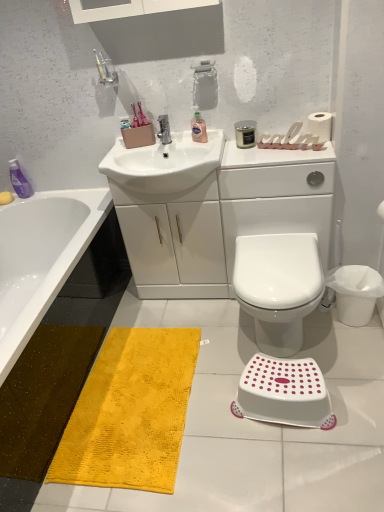
Question: Considering the relative sizes of translucent pink liquid at sink, which is the first toiletry in right-to-left order, and white glossy cabinet at center in the image provided, is translucent pink liquid at sink, which is the first toiletry in right-to-left order, taller than white glossy cabinet at center?

Choices:
 (A) yes
 (B) no

Answer: (B)

Question: Does translucent pink liquid at sink, placed as the 1th toiletry when sorted from top to bottom, contain white glossy cabinet at center?

Choices:
 (A) yes
 (B) no

Answer: (B)

Question: Is translucent pink liquid at sink, placed as the 1th toiletry when sorted from top to bottom, closer to camera compared to white glossy cabinet at center?

Choices:
 (A) no
 (B) yes

Answer: (A)

Question: Can you confirm if translucent pink liquid at sink, positioned as the first toiletry in front-to-back order, is bigger than white glossy cabinet at center?

Choices:
 (A) yes
 (B) no

Answer: (B)

Question: Does translucent pink liquid at sink, the 2th toiletry viewed from the left, have a greater width compared to white glossy cabinet at center?

Choices:
 (A) no
 (B) yes

Answer: (A)

Question: From a real-world perspective, is white matte toilet paper at upper right above or below white glossy toilet at center?

Choices:
 (A) above
 (B) below

Answer: (A)

Question: In terms of width, does white matte toilet paper at upper right look wider or thinner when compared to white glossy toilet at center?

Choices:
 (A) wide
 (B) thin

Answer: (B)

Question: Considering the relative positions of white matte toilet paper at upper right and white glossy toilet at center in the image provided, is white matte toilet paper at upper right to the left or to the right of white glossy toilet at center?

Choices:
 (A) right
 (B) left

Answer: (A)

Question: Do you think white matte toilet paper at upper right is within white glossy toilet at center, or outside of it?

Choices:
 (A) outside
 (B) inside

Answer: (A)

Question: In terms of height, does white plastic step stool at lower right look taller or shorter compared to white glossy sink at center?

Choices:
 (A) tall
 (B) short

Answer: (B)

Question: Is white plastic step stool at lower right inside or outside of white glossy sink at center?

Choices:
 (A) inside
 (B) outside

Answer: (B)

Question: Considering the positions of point (261, 412) and point (137, 153), is point (261, 412) closer or farther from the camera than point (137, 153)?

Choices:
 (A) farther
 (B) closer

Answer: (B)

Question: From a real-world perspective, is white plastic step stool at lower right above or below white glossy sink at center?

Choices:
 (A) above
 (B) below

Answer: (B)

Question: Is metallic faucet at center situated inside white plastic step stool at lower right or outside?

Choices:
 (A) inside
 (B) outside

Answer: (B)

Question: Does point (158, 134) appear closer or farther from the camera than point (324, 421)?

Choices:
 (A) closer
 (B) farther

Answer: (B)